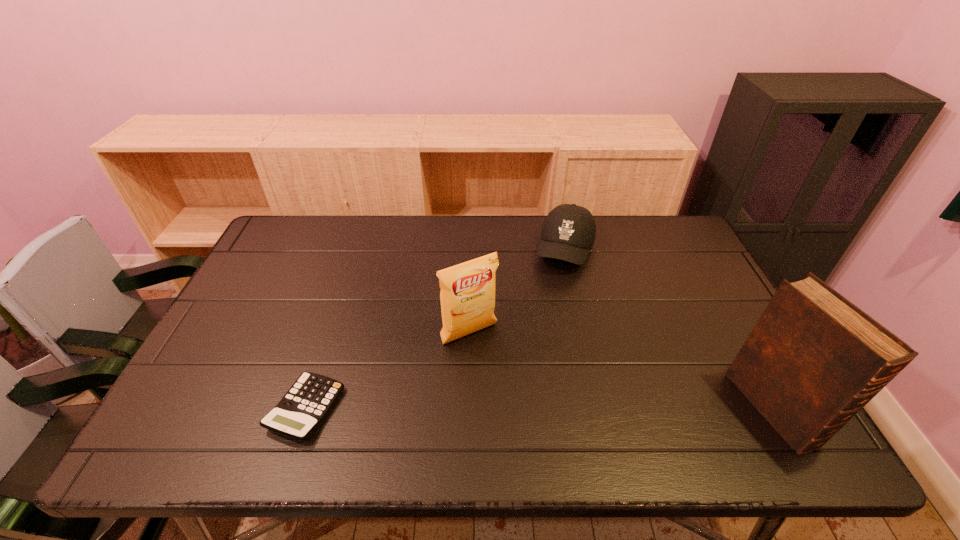
Find the location of a particular element. The height and width of the screenshot is (540, 960). empty space that is in between the calculator and the baseball cap is located at coordinates (436, 329).

The height and width of the screenshot is (540, 960). I want to click on empty space between the rightmost object and the baseball cap, so click(x=668, y=329).

You are a GUI agent. You are given a task and a screenshot of the screen. Output one action in this format:
    pyautogui.click(x=<x>, y=<y>)
    Task: Click on the vacant region between the crisp (potato chip) and the tallest object
    This screenshot has height=540, width=960.
    Given the screenshot: What is the action you would take?
    pyautogui.click(x=620, y=371)

What are the coordinates of `vacant space in between the crisp (potato chip) and the rightmost object` in the screenshot? It's located at (620, 371).

Find the location of `free space between the rightmost object and the calculator`. free space between the rightmost object and the calculator is located at coordinates (539, 408).

Identify the location of blank region between the third shortest object and the leftmost object. Image resolution: width=960 pixels, height=540 pixels. (388, 372).

You are a GUI agent. You are given a task and a screenshot of the screen. Output one action in this format:
    pyautogui.click(x=<x>, y=<y>)
    Task: Click on the object that is the second closest one to the crisp (potato chip)
    The image size is (960, 540).
    Given the screenshot: What is the action you would take?
    pyautogui.click(x=305, y=405)

Identify which object is the second nearest to the farthest object. Please provide its 2D coordinates. Your answer should be formatted as a tuple, i.e. [(x, y)], where the tuple contains the x and y coordinates of a point satisfying the conditions above.

[(813, 360)]

You are a GUI agent. You are given a task and a screenshot of the screen. Output one action in this format:
    pyautogui.click(x=<x>, y=<y>)
    Task: Click on the free space that satisfies the following two spatial constraints: 1. on the front side of the rightmost object; 2. on the right side of the third object from left to right
    
    Given the screenshot: What is the action you would take?
    pyautogui.click(x=602, y=408)

Find the location of a particular element. vacant area that satisfies the following two spatial constraints: 1. on the back side of the leftmost object; 2. on the right side of the baseball cap is located at coordinates (358, 250).